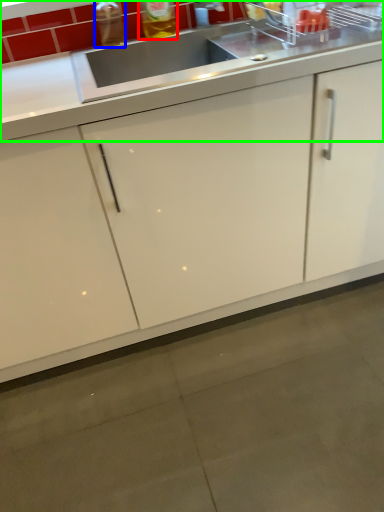
Question: Which object is positioned closest to beverage (highlighted by a red box)? Select from bottle (highlighted by a blue box) and countertop (highlighted by a green box).

Choices:
 (A) bottle
 (B) countertop

Answer: (A)